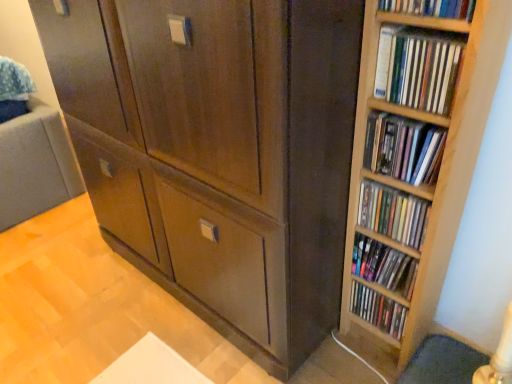
Question: Considering the positions of wooden bookshelf at upper right, the sixth book positioned from the bottom, and wooden bookshelf at right, marked as the 2th book in a top-to-bottom arrangement, in the image, is wooden bookshelf at upper right, the sixth book positioned from the bottom, taller or shorter than wooden bookshelf at right, marked as the 2th book in a top-to-bottom arrangement,?

Choices:
 (A) short
 (B) tall

Answer: (B)

Question: From the image's perspective, is wooden bookshelf at upper right, arranged as the 1th book when viewed from the top, above or below wooden bookshelf at right, marked as the 2th book in a top-to-bottom arrangement?

Choices:
 (A) above
 (B) below

Answer: (A)

Question: Which of these objects is positioned closest to the wooden bookshelf at right, the fourth book positioned from the bottom?

Choices:
 (A) matte brown cabinet at center
 (B) wooden bookshelf at upper right, the sixth book positioned from the bottom
 (C) matte wooden shelf at right, positioned as the second book in bottom-to-top order
 (D) multicolored plastic dvds at right, the sixth book in the top-to-bottom sequence
 (E) wooden bookshelf at right, which is the fifth book from bottom to top

Answer: (E)

Question: Which object is the closest to the matte brown cabinet at center?

Choices:
 (A) wooden shelves at right, the 4th book when ordered from top to bottom
 (B) wooden bookshelf at right, marked as the 2th book in a top-to-bottom arrangement
 (C) matte wooden shelf at right, positioned as the second book in bottom-to-top order
 (D) wooden bookshelf at right, the 3th book from the top
 (E) multicolored plastic dvds at right, the first book when ordered from bottom to top

Answer: (A)